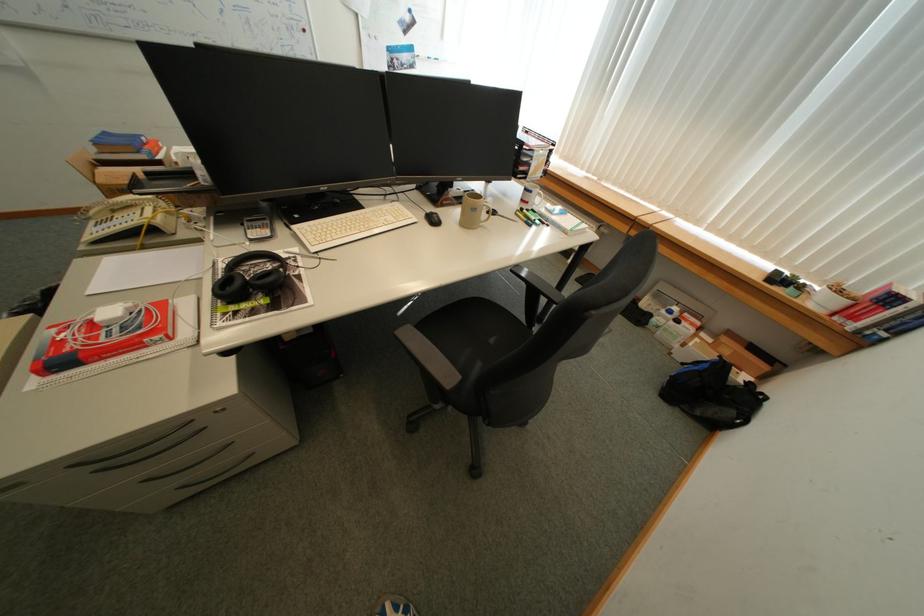
In order to click on cabinet drawer handle in this screenshot , I will do `click(130, 448)`.